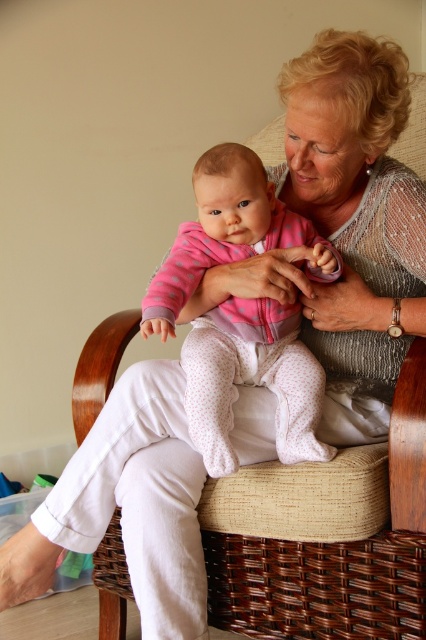
You are a photographer setting up for a family portrait. You need to position a camera stand so that both the woven brown chair at center and the pink fleece onesie at center are in frame. Considering their heights, which object should you adjust the camera angle to focus on first to ensure both are visible?

The woven brown chair at center is taller than the pink fleece onesie at center. To ensure both are visible, adjust the camera angle to focus on the taller woven brown chair at center first, then frame the shot to include the shorter pink fleece onesie at center.

You are a photographer taking a picture of the woven brown chair at center and the pink fleece onesie at center. If you move your camera to the right, which object will be more in the frame?

The pink fleece onesie at center will be more in the frame because the woven brown chair at center is to the left of it.